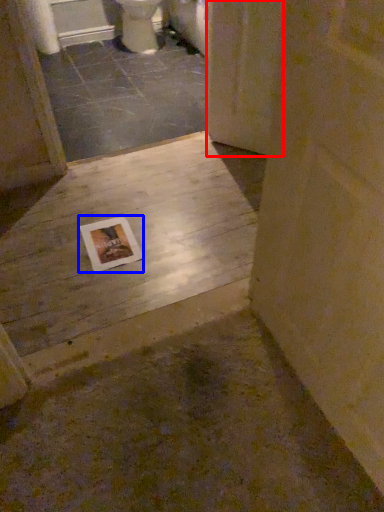
Question: Which point is further to the camera, screen door (highlighted by a red box) or postcard (highlighted by a blue box)?

Choices:
 (A) screen door
 (B) postcard

Answer: (A)